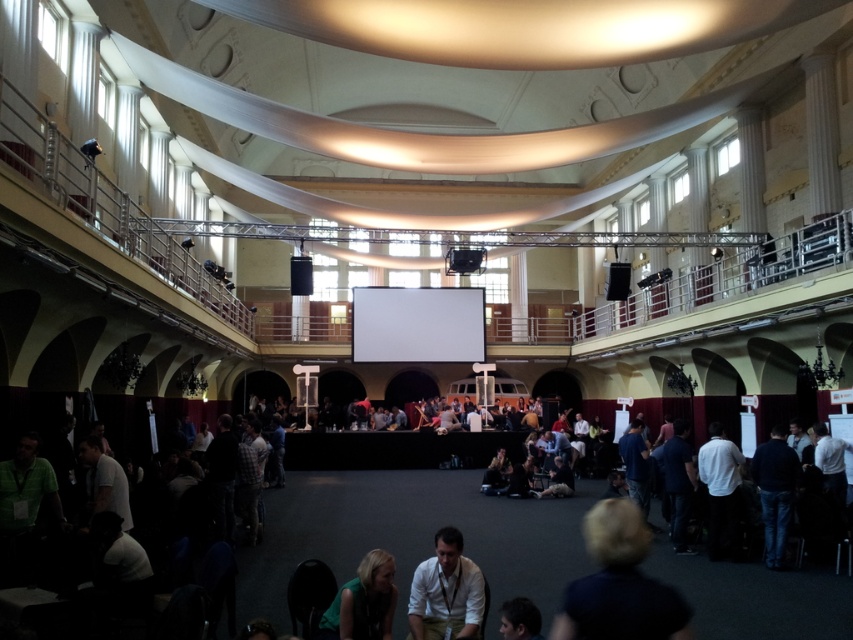
You are an event organizer and need to decide which of the two white shirts, the white shirt at lower center or the white matte shirt at center, would be more suitable for a formal event based on their appearance. Which one should you choose?

The white matte shirt at center is more suitable for a formal event because it is thicker than the white shirt at lower center, suggesting a more premium and professional appearance.